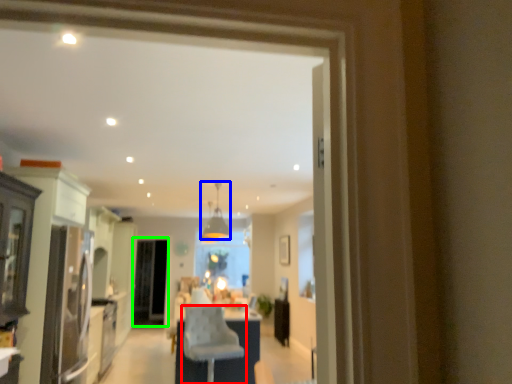
Question: Considering the real-world distances, which object is closest to chair (highlighted by a red box)? light fixture (highlighted by a blue box) or screen door (highlighted by a green box).

Choices:
 (A) light fixture
 (B) screen door

Answer: (A)